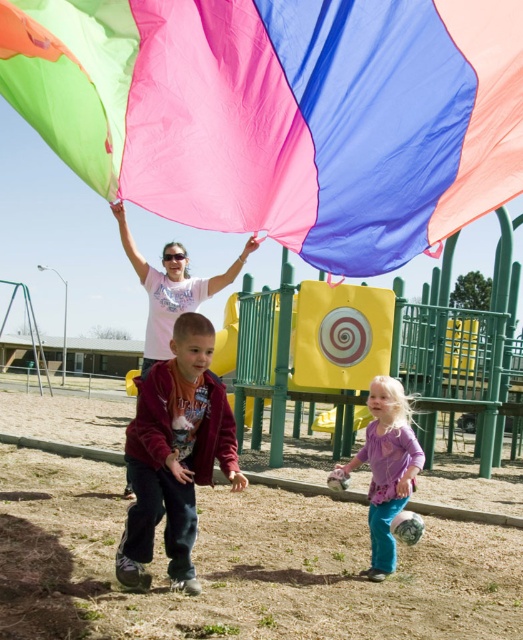
You are a child at the playground and want to find the purple soft fabric at lower right. Where should you look relative to the pastel pink fabric at center?

The purple soft fabric at lower right is positioned under the pastel pink fabric at center, so you should look beneath the pastel pink fabric at center to find it.

You are a parent at the playground. You see the purple soft fabric at lower right and the pastel pink fabric at center. Which fabric is closer to you?

The purple soft fabric at lower right is closer to you because it is in front of the pastel pink fabric at center.

You are a parent at the playground and want to ensure your child stays within your sight. You are standing at the center of the playground. Which object, the maroon fleece jacket at center or the purple soft fabric at lower right, is closer to you?

The maroon fleece jacket at center is closer to you since it is positioned to the left of the purple soft fabric at lower right, which is further away.